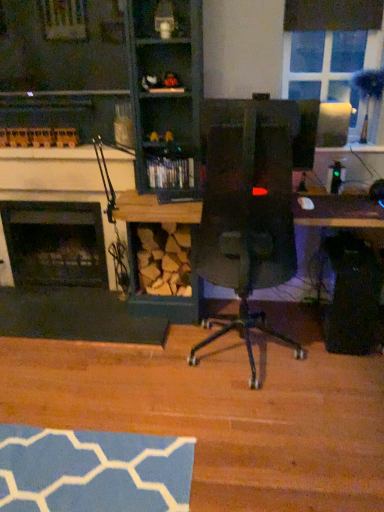
Question: Is wooden shelf at center, which ranks as the 1th shelf in bottom-to-top order, to the right of wooden shelf at upper center, the 2th shelf ordered from the bottom, from the viewer's perspective?

Choices:
 (A) no
 (B) yes

Answer: (B)

Question: Is wooden shelf at center, which appears as the 2th shelf when viewed from the top, positioned far away from wooden shelf at upper center, the 2th shelf viewed from the back?

Choices:
 (A) yes
 (B) no

Answer: (B)

Question: Could you tell me if wooden shelf at center, which is counted as the first shelf, starting from the back, is facing wooden shelf at upper center, the 1th shelf in the front-to-back sequence?

Choices:
 (A) yes
 (B) no

Answer: (B)

Question: Is wooden shelf at center, the second shelf positioned from the front, wider than wooden shelf at upper center, the 2th shelf ordered from the bottom?

Choices:
 (A) no
 (B) yes

Answer: (B)

Question: From the image's perspective, is wooden shelf at center, the second shelf positioned from the front, on wooden shelf at upper center, the first shelf viewed from the top?

Choices:
 (A) yes
 (B) no

Answer: (B)

Question: Is wooden shelf at center, which appears as the 2th shelf when viewed from the top, thinner than wooden shelf at upper center, the first shelf viewed from the top?

Choices:
 (A) no
 (B) yes

Answer: (A)

Question: Can you confirm if wooden shelf at upper center, the 2th shelf viewed from the back, is shorter than wooden shelf at center, the second shelf positioned from the front?

Choices:
 (A) yes
 (B) no

Answer: (A)

Question: Can you confirm if wooden shelf at upper center, the 1th shelf in the front-to-back sequence, is bigger than wooden shelf at center, which is counted as the first shelf, starting from the back?

Choices:
 (A) yes
 (B) no

Answer: (B)

Question: From the image's perspective, is wooden shelf at upper center, the 2th shelf ordered from the bottom, under wooden shelf at center, which appears as the 2th shelf when viewed from the top?

Choices:
 (A) no
 (B) yes

Answer: (A)

Question: Is wooden shelf at upper center, the first shelf viewed from the top, taller than wooden shelf at center, which appears as the 2th shelf when viewed from the top?

Choices:
 (A) yes
 (B) no

Answer: (B)

Question: Is wooden shelf at upper center, the 2th shelf ordered from the bottom, to the left of wooden shelf at center, which is counted as the first shelf, starting from the back, from the viewer's perspective?

Choices:
 (A) yes
 (B) no

Answer: (A)

Question: Does wooden shelf at upper center, the 2th shelf ordered from the bottom, lie in front of wooden shelf at center, which appears as the 2th shelf when viewed from the top?

Choices:
 (A) yes
 (B) no

Answer: (A)

Question: Can you confirm if black matte fireplace at left, marked as the 2th fireplace in a front-to-back arrangement, is wider than wooden fireplace at left?

Choices:
 (A) yes
 (B) no

Answer: (B)